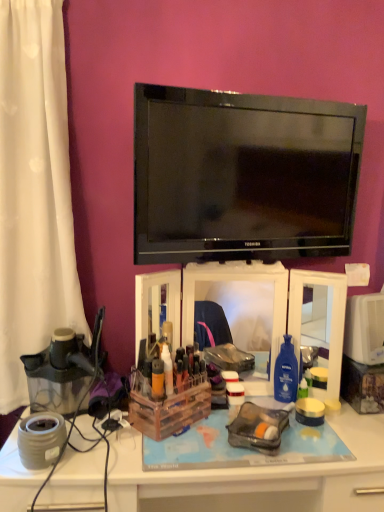
Question: In terms of width, does wooden/clear plastic storage box at center look wider or thinner when compared to transparent plastic juicer at left?

Choices:
 (A) thin
 (B) wide

Answer: (A)

Question: From a real-world perspective, is wooden/clear plastic storage box at center positioned above or below transparent plastic juicer at left?

Choices:
 (A) above
 (B) below

Answer: (B)

Question: Which is farther from the transparent plastic juicer at left?

Choices:
 (A) black glossy tv at upper center
 (B) wooden/clear plastic storage box at center
 (C) transparent plastic makeup organizer at center
 (D) white plastic desk at lower center

Answer: (A)

Question: Which of these objects is positioned farthest from the transparent plastic makeup organizer at center?

Choices:
 (A) white plastic desk at lower center
 (B) wooden/clear plastic storage box at center
 (C) transparent plastic juicer at left
 (D) black glossy tv at upper center

Answer: (C)